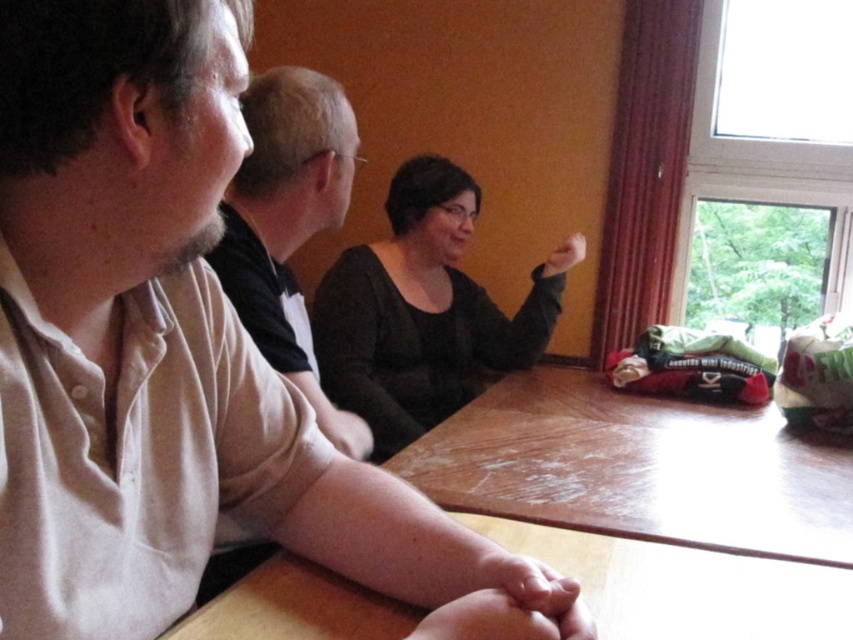
Does black matte shirt at center appear over light beige shirt at left?

No.

In the scene shown: Is black matte shirt at center shorter than light beige shirt at left?

Incorrect, black matte shirt at center's height does not fall short of light beige shirt at left's.

At what (x,y) coordinates should I click in order to perform the action: click on black matte shirt at center. Please return your answer as a coordinate pair (x, y). Looking at the image, I should click on (424, 310).

Does matte beige shirt at center have a greater width compared to light beige shirt at left?

Correct, the width of matte beige shirt at center exceeds that of light beige shirt at left.

The width and height of the screenshot is (853, 640). Identify the location of matte beige shirt at center. (173, 356).

Identify the location of matte beige shirt at center. (173, 356).

Does matte beige shirt at center have a lesser height compared to black matte shirt at center?

Indeed, matte beige shirt at center has a lesser height compared to black matte shirt at center.

Between point (94, 625) and point (412, 376), which one is positioned behind?

The point (412, 376) is more distant.

The width and height of the screenshot is (853, 640). What are the coordinates of `matte beige shirt at center` in the screenshot? It's located at (173, 356).